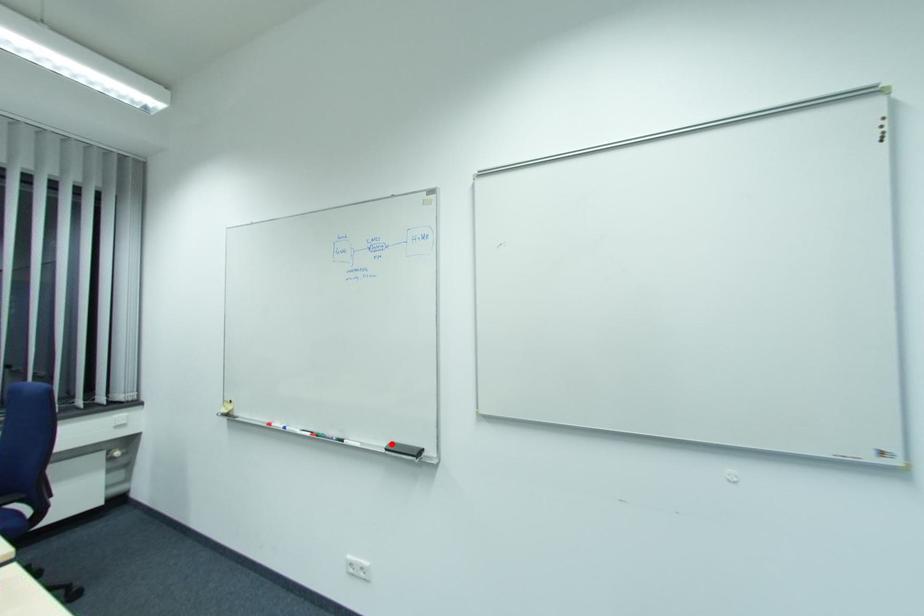
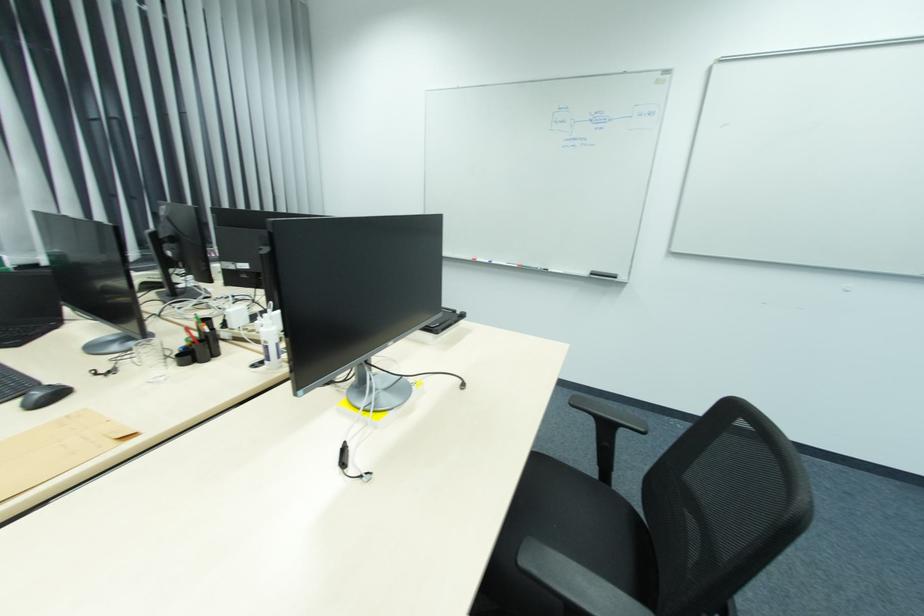
Locate, in the second image, the point that corresponds to the highlighted location in the first image.

(592, 272)